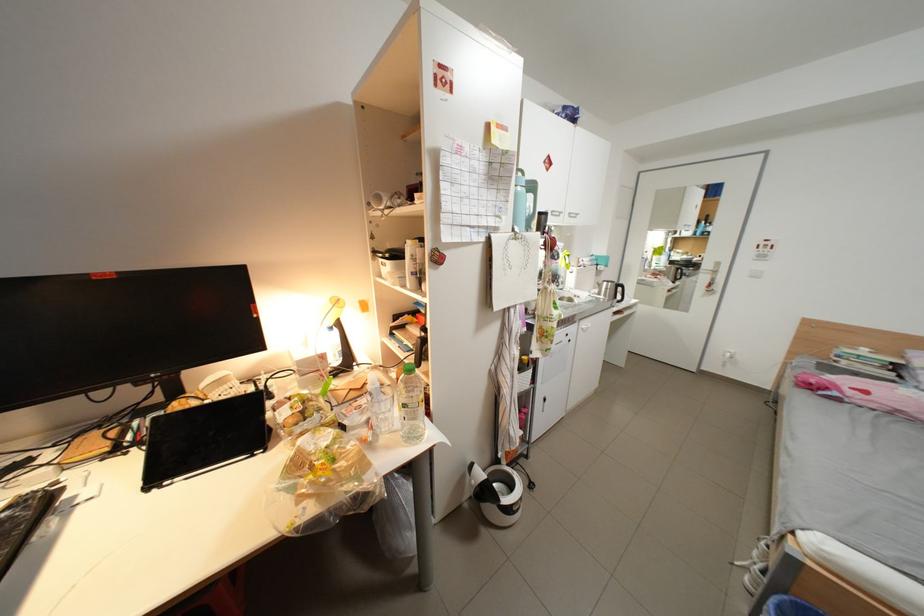
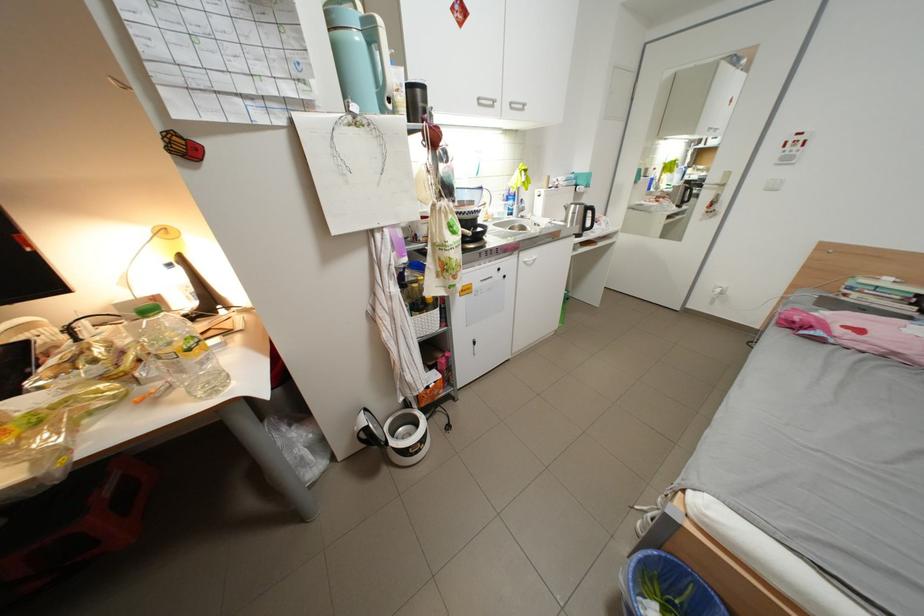
Where in the second image is the point corresponding to pixel 856 363 from the first image?

(867, 296)